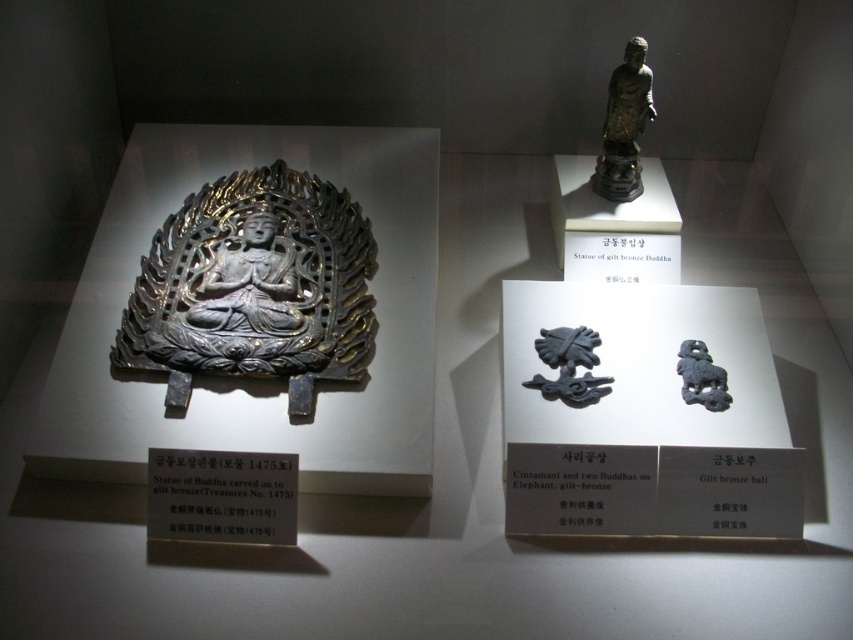
Who is higher up, matte silver statue at center or matte gray stone lion at center-right?

matte silver statue at center is above.

Which is in front, point (306, 326) or point (701, 342)?

Point (306, 326) is in front.

Find the location of `matte silver statue at center`. matte silver statue at center is located at coordinates (250, 284).

Is gilt bronze buddha at upper right behind black matte cintamani at center?

That is True.

The width and height of the screenshot is (853, 640). Describe the element at coordinates (624, 125) in the screenshot. I see `gilt bronze buddha at upper right` at that location.

Is point (613, 150) behind point (593, 378)?

Yes, point (613, 150) is behind point (593, 378).

Where is `gilt bronze buddha at upper right`? This screenshot has height=640, width=853. gilt bronze buddha at upper right is located at coordinates (624, 125).

Between gilt-bronze buddha at center and matte gray stone lion at center-right, which one has less height?

With less height is matte gray stone lion at center-right.

Does point (190, 337) lie in front of point (689, 339)?

Yes, it is.

The width and height of the screenshot is (853, 640). What do you see at coordinates (254, 288) in the screenshot? I see `gilt-bronze buddha at center` at bounding box center [254, 288].

I want to click on gilt-bronze buddha at center, so click(254, 288).